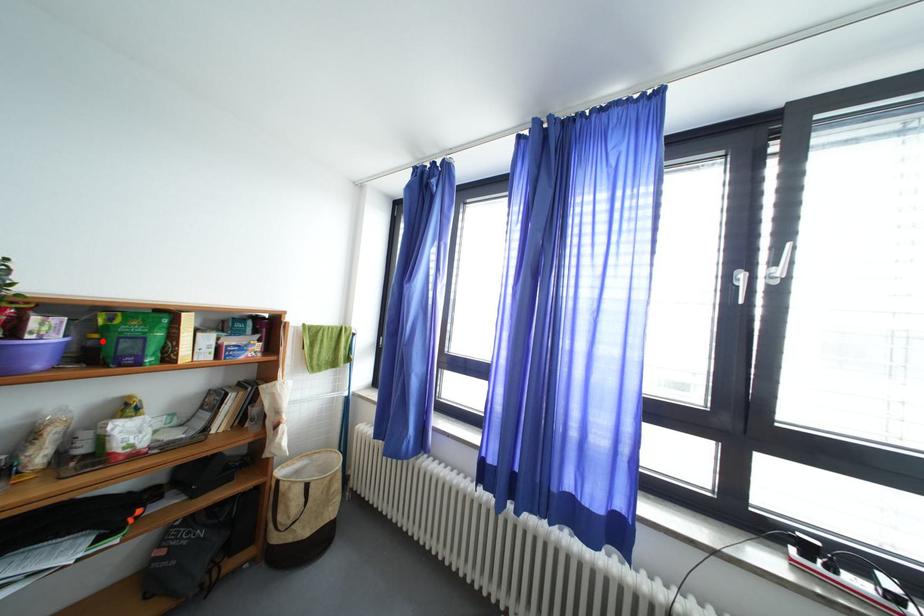
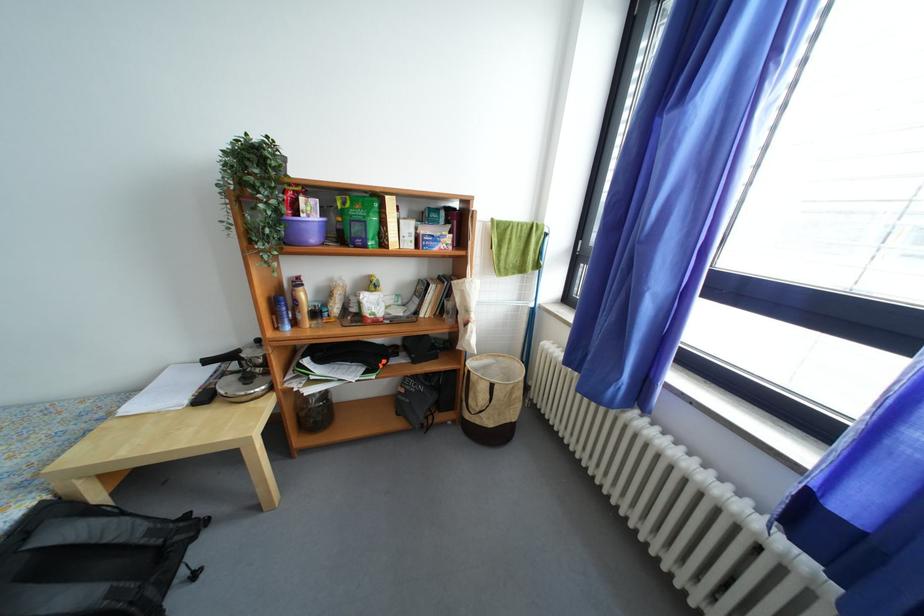
Where in the second image is the point corresponding to the highlighted location from the first image?

(346, 224)